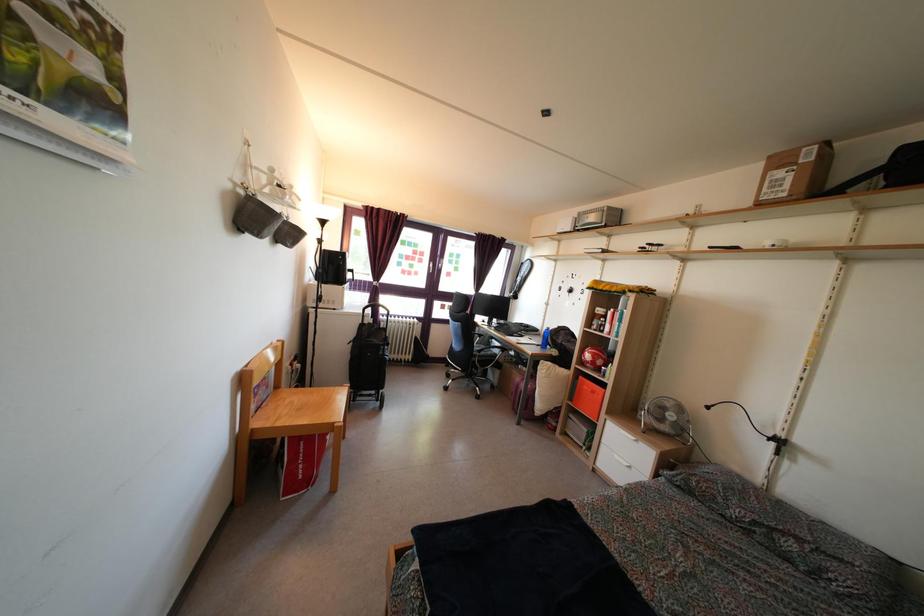
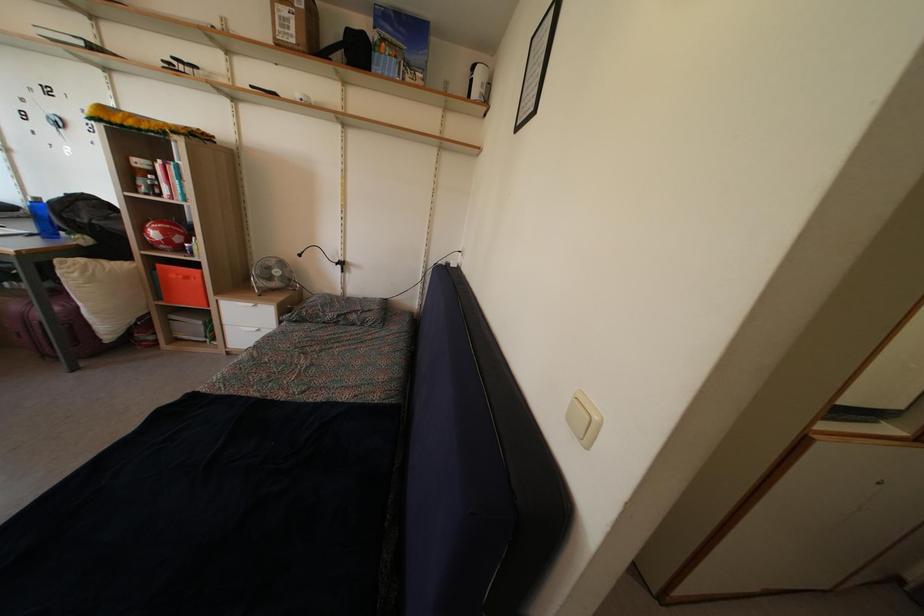
Where in the second image is the point corresponding to point 564,375 from the first image?

(116, 268)